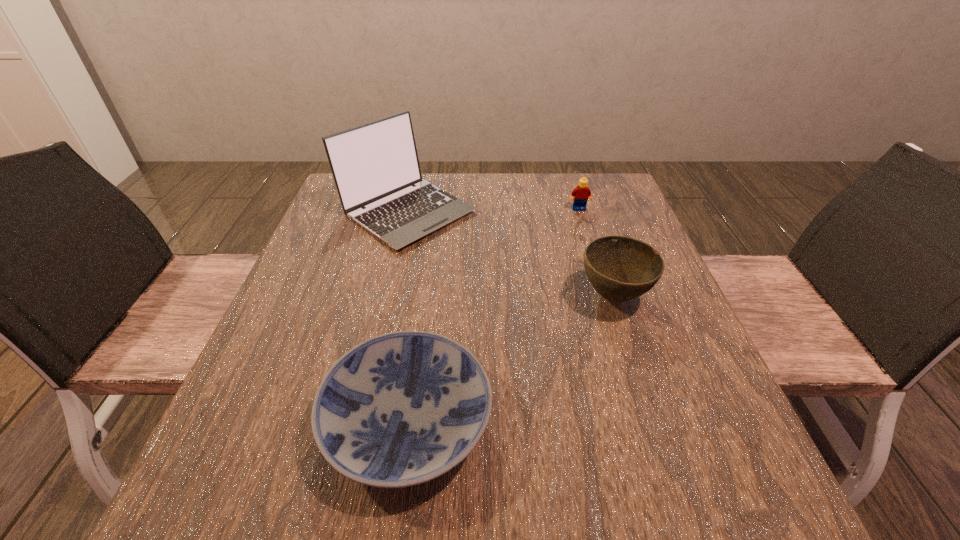
Image resolution: width=960 pixels, height=540 pixels. I want to click on the tallest object, so click(x=375, y=166).

The image size is (960, 540). What are the coordinates of `the second nearest object` in the screenshot? It's located at (620, 268).

You are a GUI agent. You are given a task and a screenshot of the screen. Output one action in this format:
    pyautogui.click(x=<x>, y=<y>)
    Task: Click on the Lego
    Image resolution: width=960 pixels, height=540 pixels.
    Given the screenshot: What is the action you would take?
    pyautogui.click(x=582, y=193)

Image resolution: width=960 pixels, height=540 pixels. In order to click on plate in this screenshot , I will do `click(400, 409)`.

The image size is (960, 540). I want to click on the nearest object, so click(400, 409).

Identify the location of free location located at the front screen of the laptop_computer. The image size is (960, 540). (391, 286).

This screenshot has height=540, width=960. I want to click on vacant area situated 0.190m on the front of the third farthest object, so click(651, 407).

Image resolution: width=960 pixels, height=540 pixels. Identify the location of free space located 0.350m on the front-facing side of the Lego. pyautogui.click(x=609, y=302).

The width and height of the screenshot is (960, 540). In order to click on vacant space located on the left of the nearest object in this screenshot , I will do (x=269, y=422).

At what (x,y) coordinates should I click in order to perform the action: click on laptop_computer that is at the far edge. Please return your answer as a coordinate pair (x, y). This screenshot has height=540, width=960. Looking at the image, I should click on (375, 166).